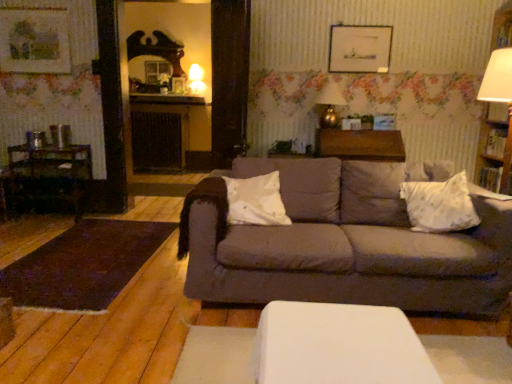
Question: Is wooden picture frame at upper left, the 2th picture frame positioned from the right, at the right side of wooden table at center?

Choices:
 (A) no
 (B) yes

Answer: (A)

Question: Considering the relative sizes of wooden picture frame at upper left, the 2th picture frame positioned from the right, and wooden table at center in the image provided, is wooden picture frame at upper left, the 2th picture frame positioned from the right, wider than wooden table at center?

Choices:
 (A) yes
 (B) no

Answer: (B)

Question: From a real-world perspective, is wooden picture frame at upper left, the first picture frame in the left-to-right sequence, over wooden table at center?

Choices:
 (A) yes
 (B) no

Answer: (A)

Question: Does wooden picture frame at upper left, the 2th picture frame positioned from the right, come behind wooden table at center?

Choices:
 (A) yes
 (B) no

Answer: (A)

Question: From the image's perspective, is wooden picture frame at upper left, the first picture frame in the left-to-right sequence, above wooden table at center?

Choices:
 (A) no
 (B) yes

Answer: (B)

Question: Is wooden picture frame at upper left, the first picture frame in the left-to-right sequence, shorter than wooden table at center?

Choices:
 (A) yes
 (B) no

Answer: (B)

Question: Does wooden picture frame at upper center, which appears as the 2th picture frame when viewed from the left, have a larger size compared to matte white glass table lamp at upper center, which ranks as the 2th table lamp in right-to-left order?

Choices:
 (A) yes
 (B) no

Answer: (B)

Question: Could matte white glass table lamp at upper center, which is the first table lamp from back to front, be considered to be inside wooden picture frame at upper center, which appears as the 2th picture frame when viewed from the left?

Choices:
 (A) no
 (B) yes

Answer: (A)

Question: Does wooden picture frame at upper center, which appears as the first picture frame when viewed from the right, appear on the left side of matte white glass table lamp at upper center, which appears as the 2th table lamp when ordered from the bottom?

Choices:
 (A) no
 (B) yes

Answer: (A)

Question: From the image's perspective, is wooden picture frame at upper center, which appears as the first picture frame when viewed from the right, located above matte white glass table lamp at upper center, the second table lamp when ordered from front to back?

Choices:
 (A) no
 (B) yes

Answer: (A)

Question: Does wooden picture frame at upper center, which appears as the first picture frame when viewed from the right, have a lesser width compared to matte white glass table lamp at upper center, which is the 1th table lamp from top to bottom?

Choices:
 (A) yes
 (B) no

Answer: (A)

Question: Is wooden picture frame at upper center, which appears as the first picture frame when viewed from the right, smaller than matte white glass table lamp at upper center, positioned as the first table lamp in left-to-right order?

Choices:
 (A) no
 (B) yes

Answer: (B)

Question: Can you confirm if matte gray couch at center is thinner than wooden dark chair at left?

Choices:
 (A) yes
 (B) no

Answer: (B)